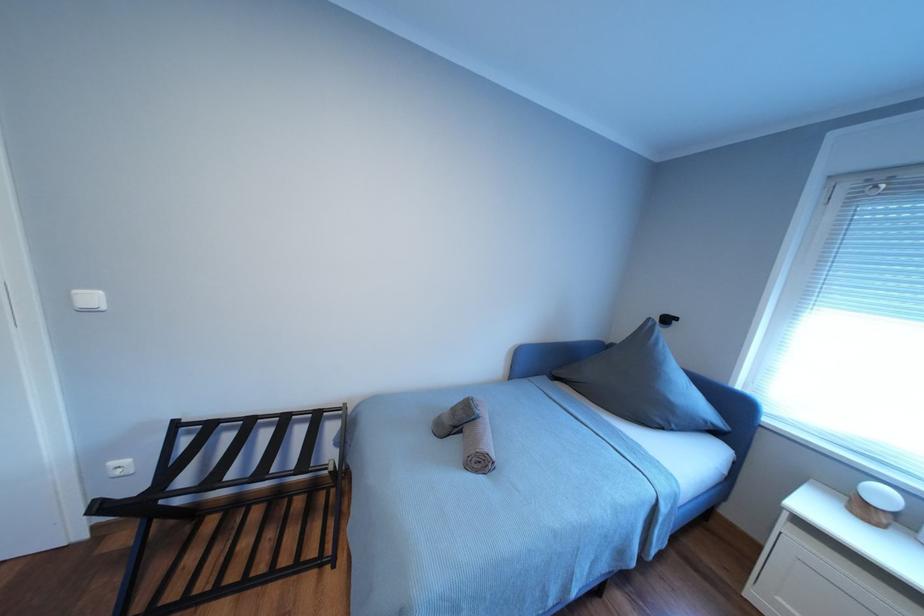
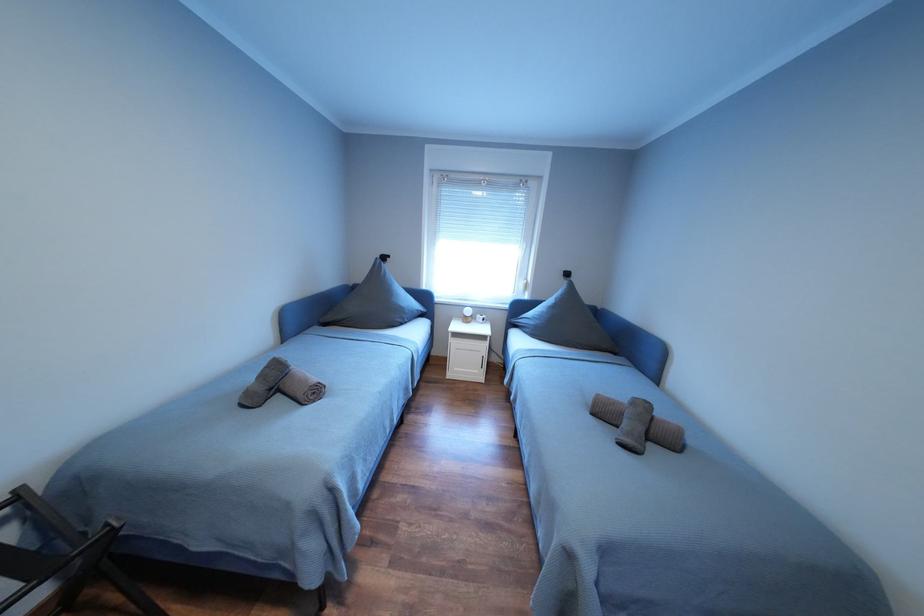
How did the camera likely rotate?

A: The camera's rotation is toward right-down.